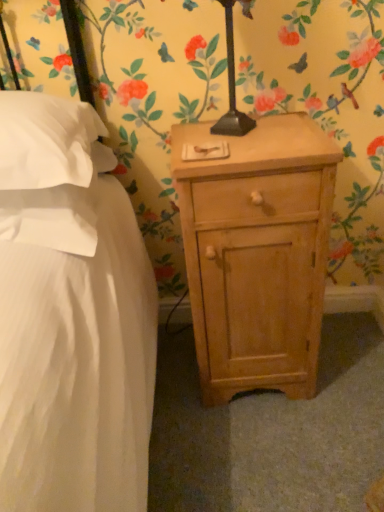
Question: From a real-world perspective, does white soft pillow at left, placed as the 2th pillow when sorted from bottom to top, stand above light wood nightstand at lower right?

Choices:
 (A) no
 (B) yes

Answer: (B)

Question: Is white soft pillow at left, placed as the 2th pillow when sorted from bottom to top, shorter than light wood nightstand at lower right?

Choices:
 (A) no
 (B) yes

Answer: (B)

Question: Is white soft pillow at left, the first pillow in the top-to-bottom sequence, surrounding light wood nightstand at lower right?

Choices:
 (A) no
 (B) yes

Answer: (A)

Question: Does white soft pillow at left, placed as the 2th pillow when sorted from bottom to top, turn towards light wood nightstand at lower right?

Choices:
 (A) yes
 (B) no

Answer: (B)

Question: From a real-world perspective, is white soft pillow at left, placed as the 2th pillow when sorted from bottom to top, positioned under light wood nightstand at lower right based on gravity?

Choices:
 (A) yes
 (B) no

Answer: (B)

Question: Considering the relative sizes of white soft pillow at left, placed as the 2th pillow when sorted from bottom to top, and light wood nightstand at lower right in the image provided, is white soft pillow at left, placed as the 2th pillow when sorted from bottom to top, thinner than light wood nightstand at lower right?

Choices:
 (A) no
 (B) yes

Answer: (A)

Question: From the image's perspective, is white soft pillow at left, which is the 2th pillow from top to bottom, beneath white soft pillow at left, placed as the 2th pillow when sorted from bottom to top?

Choices:
 (A) no
 (B) yes

Answer: (B)

Question: Does white soft pillow at left, which is the 2th pillow from top to bottom, lie behind white soft pillow at left, placed as the 2th pillow when sorted from bottom to top?

Choices:
 (A) yes
 (B) no

Answer: (A)

Question: Is white soft pillow at left, which is the 2th pillow from top to bottom, positioned far away from white soft pillow at left, placed as the 2th pillow when sorted from bottom to top?

Choices:
 (A) yes
 (B) no

Answer: (B)

Question: Is white soft pillow at left, which is the 2th pillow from top to bottom, positioned beyond the bounds of white soft pillow at left, the first pillow in the top-to-bottom sequence?

Choices:
 (A) yes
 (B) no

Answer: (A)

Question: Is white soft pillow at left, positioned as the 1th pillow in bottom-to-top order, at the right side of white soft pillow at left, placed as the 2th pillow when sorted from bottom to top?

Choices:
 (A) yes
 (B) no

Answer: (B)

Question: Is white soft pillow at left, which is the 2th pillow from top to bottom, thinner than white soft pillow at left, the first pillow in the top-to-bottom sequence?

Choices:
 (A) yes
 (B) no

Answer: (A)

Question: Is white soft pillow at left, placed as the 2th pillow when sorted from bottom to top, to the left of white soft pillow at left, positioned as the 1th pillow in bottom-to-top order, from the viewer's perspective?

Choices:
 (A) no
 (B) yes

Answer: (A)